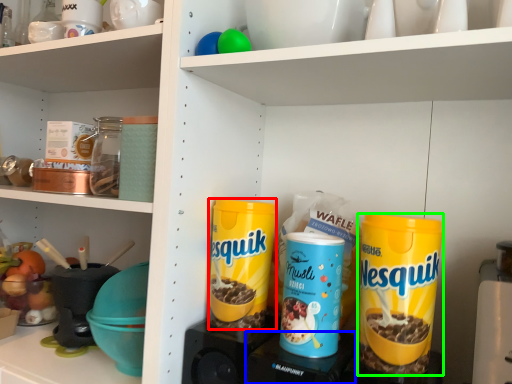
Question: Which is nearer to the cereal (highlighted by a red box)? appliance (highlighted by a blue box) or cereal (highlighted by a green box).

Choices:
 (A) appliance
 (B) cereal

Answer: (A)